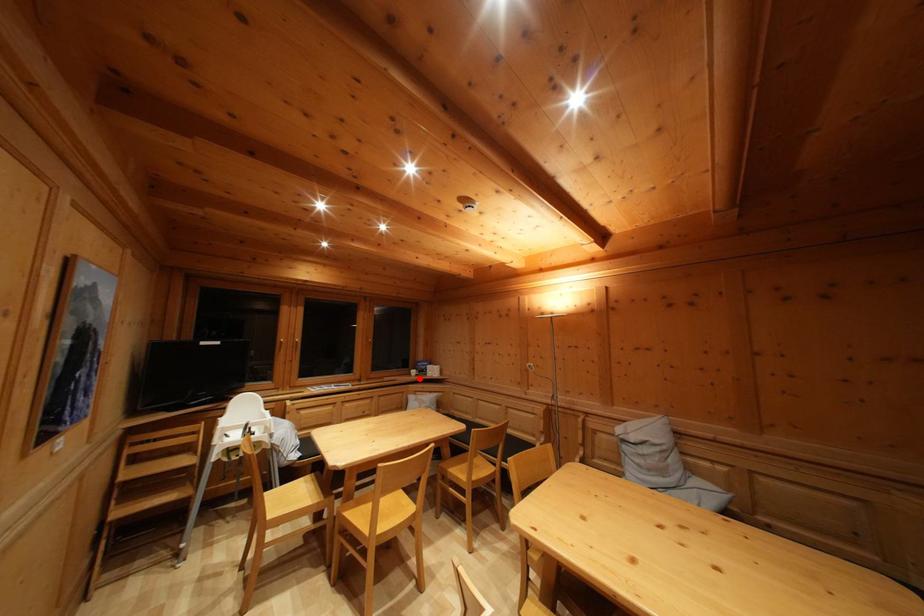
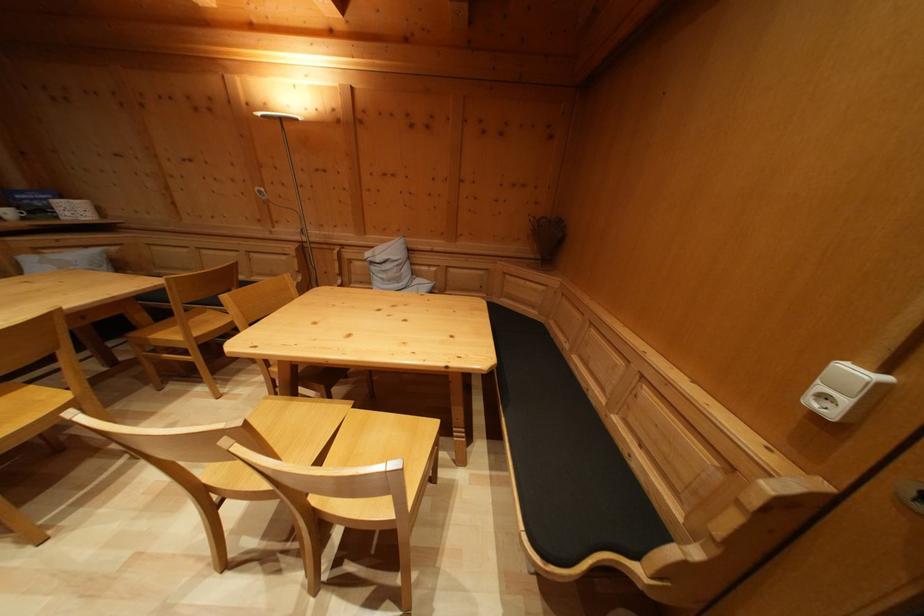
The point at the highlighted location is marked in the first image. Where is the corresponding point in the second image?

(14, 219)